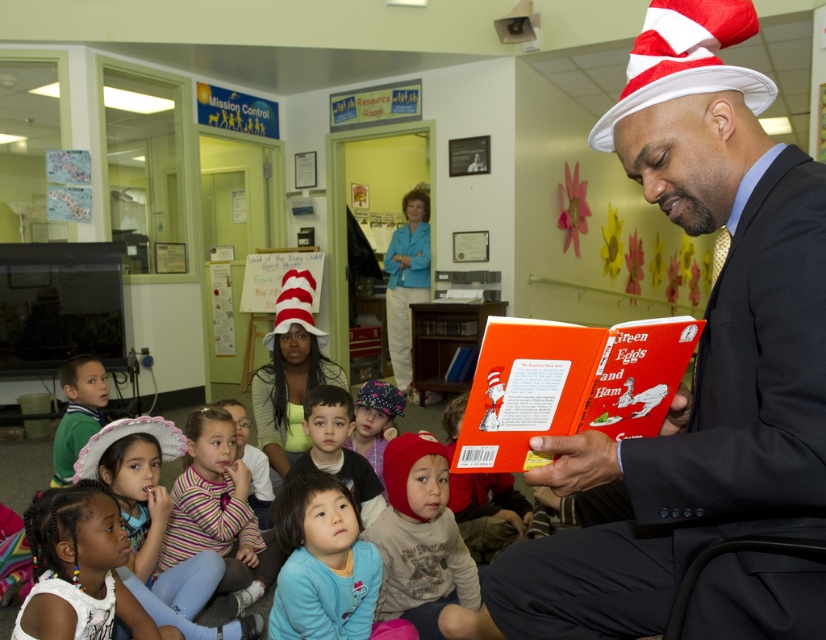
Can you confirm if orange paper book at center is positioned below blue fabric shirt at upper center?

Indeed, orange paper book at center is positioned under blue fabric shirt at upper center.

Is the position of orange paper book at center more distant than that of blue fabric shirt at upper center?

No.

Identify the location of orange paper book at center. (568, 385).

Where is `orange paper book at center`? orange paper book at center is located at coordinates (568, 385).

Can you confirm if smooth skin face at center is positioned below blue fabric shirt at upper center?

Correct, smooth skin face at center is located below blue fabric shirt at upper center.

Is smooth skin face at center thinner than blue fabric shirt at upper center?

Indeed, smooth skin face at center has a lesser width compared to blue fabric shirt at upper center.

Who is more forward, (x=311, y=440) or (x=425, y=291)?

Positioned in front is point (x=311, y=440).

Locate an element on the screen. smooth skin face at center is located at coordinates (336, 449).

Is point (729, 32) behind point (667, 337)?

No, it is not.

Between point (770, 572) and point (573, 394), which one is positioned in front?

Point (770, 572) is in front.

Locate an element on the screen. matte black suit at center is located at coordinates (698, 348).